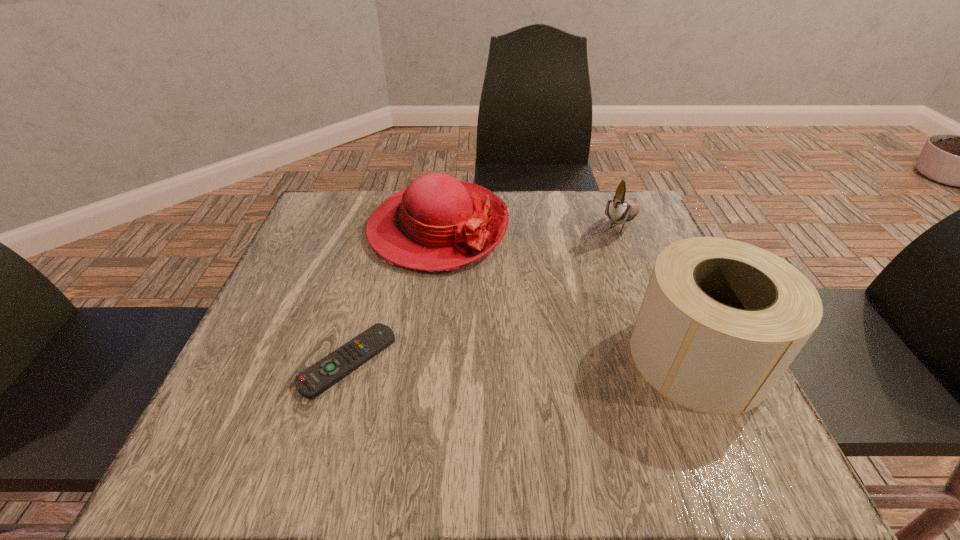
The height and width of the screenshot is (540, 960). What are the coordinates of `vacant point that satisfies the following two spatial constraints: 1. on the back side of the toilet tissue; 2. on the right side of the remote control` in the screenshot? It's located at (349, 357).

Locate an element on the screen. The image size is (960, 540). vacant position in the image that satisfies the following two spatial constraints: 1. on the back side of the bird; 2. on the left side of the remote control is located at coordinates (385, 224).